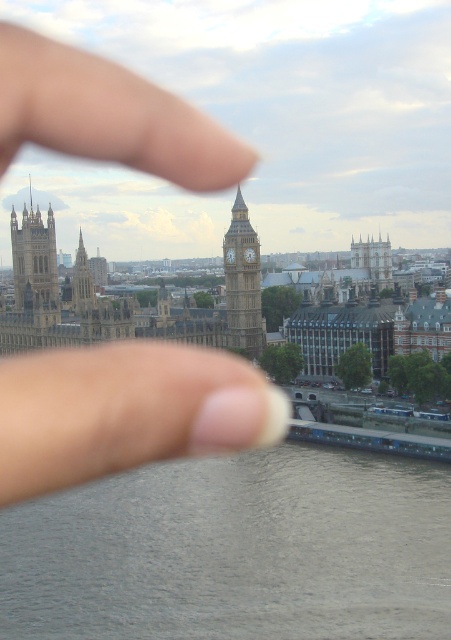
Can you confirm if white matte finger at center is positioned above golden stone tower at upper left?

Actually, white matte finger at center is below golden stone tower at upper left.

Is the position of white matte finger at center more distant than that of golden stone tower at upper left?

No.

What do you see at coordinates (125, 412) in the screenshot? Image resolution: width=451 pixels, height=640 pixels. I see `white matte finger at center` at bounding box center [125, 412].

Locate an element on the screen. white matte finger at center is located at coordinates (125, 412).

Who is positioned more to the left, flesh-toned skin at center or golden stone clock tower at center?

flesh-toned skin at center is more to the left.

Does flesh-toned skin at center have a lesser width compared to golden stone clock tower at center?

Yes.

Describe the element at coordinates (107, 115) in the screenshot. This screenshot has width=451, height=640. I see `flesh-toned skin at center` at that location.

You are a GUI agent. You are given a task and a screenshot of the screen. Output one action in this format:
    pyautogui.click(x=<x>, y=<y>)
    Task: Click on the flesh-toned skin at center
    The width and height of the screenshot is (451, 640).
    Given the screenshot: What is the action you would take?
    click(107, 115)

Can you confirm if gray smooth water at lower center is positioned below green stone tower at center?

Yes.

Between point (228, 573) and point (87, 278), which one is positioned behind?

The point (87, 278) is behind.

This screenshot has height=640, width=451. Find the location of `gray smooth water at lower center`. gray smooth water at lower center is located at coordinates click(235, 552).